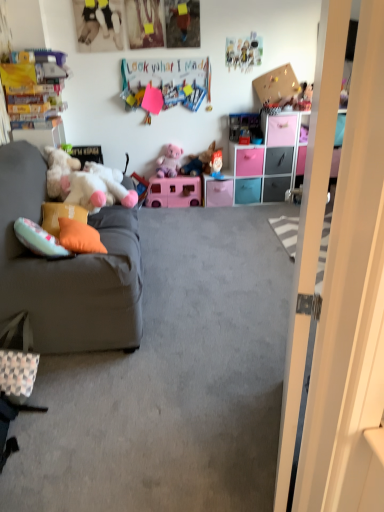
Locate an element on the screen. vacant region in front of teal plastic drawer at center, which is the third drawer from left to right is located at coordinates (247, 211).